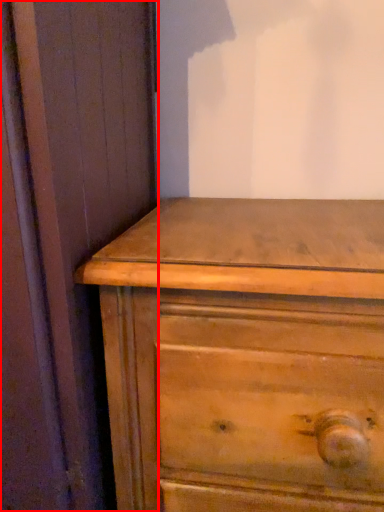
Question: From the image's perspective, what is the correct spatial positioning of screen door (annotated by the red box) in reference to chest of drawers?

Choices:
 (A) above
 (B) below

Answer: (A)